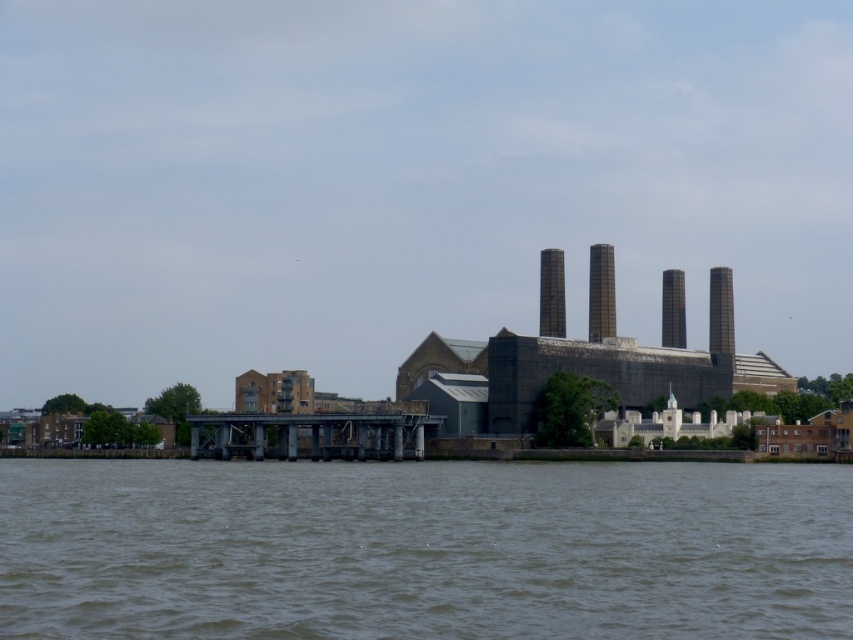
You are a photographer positioned at the waterfront scene. You want to capture both the black glass chimney at center and the smooth gray chimney at center in your shot. Which chimney will appear closer to the camera in your photograph?

The black glass chimney at center will appear closer to the camera because it is positioned in front of the smooth gray chimney at center.

You are a drone operator tasked with capturing aerial footage of the waterfront scene. You notice the brown water at lower center and the smooth gray chimney at center. Which object would require you to ascend higher to fully capture its height in your shot?

The smooth gray chimney at center is taller than the brown water at lower center, so you would need to ascend higher to fully capture its height in your shot.